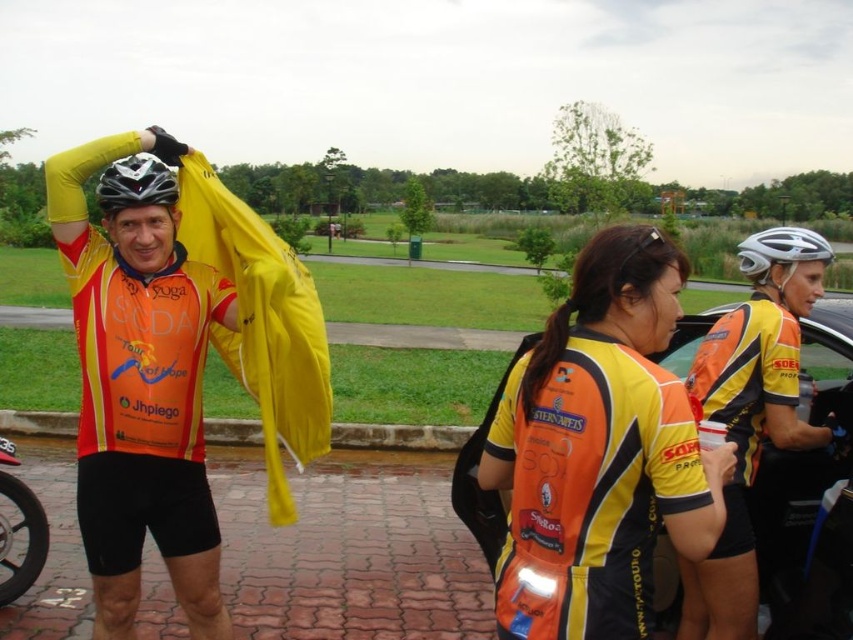
Question: Which object is the closest to the black rubber tire at lower left?

Choices:
 (A) matte yellow jacket at center
 (B) white matte bicycle helmet at upper right
 (C) matte black helmet at upper left
 (D) yellow-orange cycling jersey at center

Answer: (A)

Question: From the image, what is the correct spatial relationship of black rubber tire at lower left in relation to matte black helmet at upper left?

Choices:
 (A) below
 (B) above

Answer: (A)

Question: Which point is closer to the camera?

Choices:
 (A) matte black helmet at upper left
 (B) orange jersey at center

Answer: (A)

Question: Does orange jersey at center appear under black rubber tire at lower left?

Choices:
 (A) yes
 (B) no

Answer: (B)

Question: Is matte yellow jacket at center bigger than white matte bicycle helmet at upper right?

Choices:
 (A) no
 (B) yes

Answer: (A)

Question: Which point is farther from the camera taking this photo?

Choices:
 (A) (187, 458)
 (B) (589, 483)
 (C) (32, 541)
 (D) (120, 168)

Answer: (C)